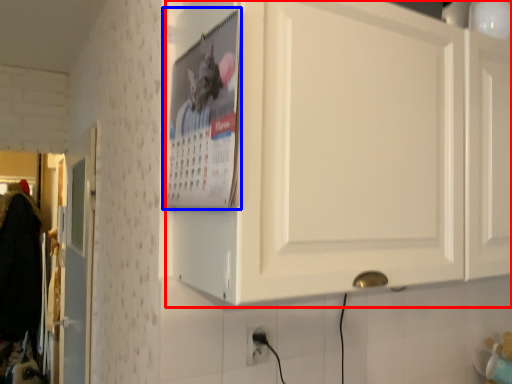
Question: Which object appears closest to the camera in this image, cabinetry (highlighted by a red box) or poster page (highlighted by a blue box)?

Choices:
 (A) cabinetry
 (B) poster page

Answer: (A)